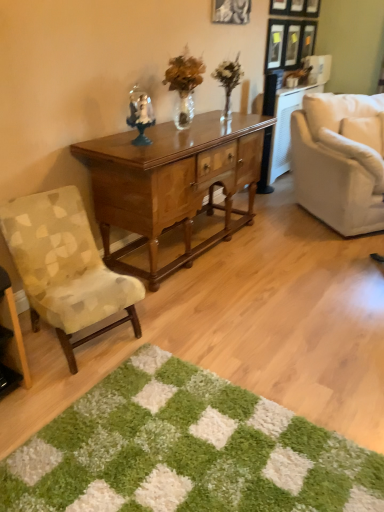
Question: From a real-world perspective, does black matte picture frame at upper center stand above polished wood desk at center?

Choices:
 (A) no
 (B) yes

Answer: (B)

Question: Can you confirm if black matte picture frame at upper center is positioned to the left of polished wood desk at center?

Choices:
 (A) no
 (B) yes

Answer: (A)

Question: Does black matte picture frame at upper center have a larger size compared to polished wood desk at center?

Choices:
 (A) yes
 (B) no

Answer: (B)

Question: From the image's perspective, is black matte picture frame at upper center above polished wood desk at center?

Choices:
 (A) no
 (B) yes

Answer: (B)

Question: Does black matte picture frame at upper center lie behind polished wood desk at center?

Choices:
 (A) yes
 (B) no

Answer: (A)

Question: Is black matte picture frame at upper center bigger or smaller than polished wood desk at center?

Choices:
 (A) small
 (B) big

Answer: (A)

Question: From the image's perspective, is black matte picture frame at upper center positioned above or below polished wood desk at center?

Choices:
 (A) below
 (B) above

Answer: (B)

Question: From their relative heights in the image, would you say black matte picture frame at upper center is taller or shorter than polished wood desk at center?

Choices:
 (A) short
 (B) tall

Answer: (A)

Question: From a real-world perspective, relative to polished wood desk at center, is black matte picture frame at upper center vertically above or below?

Choices:
 (A) below
 (B) above

Answer: (B)

Question: Would you say green shaggy rug at lower center is to the left or to the right of black matte picture frame at upper center in the picture?

Choices:
 (A) left
 (B) right

Answer: (A)

Question: Is green shaggy rug at lower center bigger or smaller than black matte picture frame at upper center?

Choices:
 (A) big
 (B) small

Answer: (A)

Question: Relative to black matte picture frame at upper center, is green shaggy rug at lower center in front or behind?

Choices:
 (A) front
 (B) behind

Answer: (A)

Question: Is green shaggy rug at lower center taller or shorter than black matte picture frame at upper center?

Choices:
 (A) short
 (B) tall

Answer: (A)

Question: From the image's perspective, is patterned fabric chair at left, the first chair when ordered from left to right, located above or below green shaggy rug at lower center?

Choices:
 (A) below
 (B) above

Answer: (B)

Question: From a real-world perspective, is patterned fabric chair at left, which is counted as the second chair, starting from the right, physically located above or below green shaggy rug at lower center?

Choices:
 (A) above
 (B) below

Answer: (A)